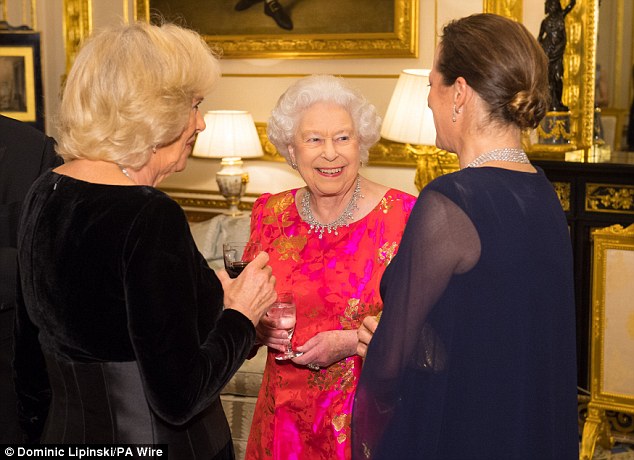
This screenshot has width=634, height=460. Find the location of `glass`. glass is located at coordinates (240, 250), (285, 321).